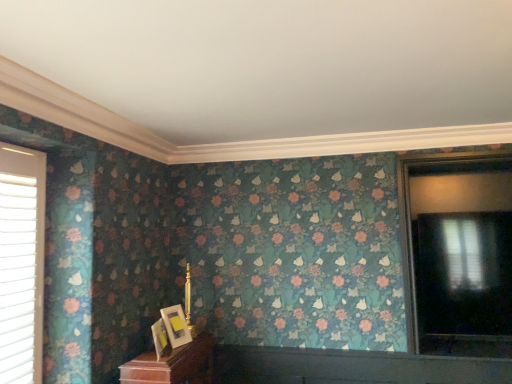
Question: Can you confirm if matte black window at right, which ranks as the first window in right-to-left order, is bigger than matte gold picture frame at lower center, which is the 1th picture frame in front-to-back order?

Choices:
 (A) no
 (B) yes

Answer: (B)

Question: Considering the relative sizes of matte black window at right, which is the second window from front to back, and matte gold picture frame at lower center, the 2th picture frame viewed from the back, in the image provided, is matte black window at right, which is the second window from front to back, shorter than matte gold picture frame at lower center, the 2th picture frame viewed from the back,?

Choices:
 (A) no
 (B) yes

Answer: (A)

Question: Does matte black window at right, which is the second window from front to back, have a greater height compared to matte gold picture frame at lower center, the 2th picture frame viewed from the back?

Choices:
 (A) yes
 (B) no

Answer: (A)

Question: Is matte gold picture frame at lower center, which is the 1th picture frame in front-to-back order, a part of matte black window at right, which ranks as the first window in right-to-left order?

Choices:
 (A) yes
 (B) no

Answer: (B)

Question: Does matte black window at right, which is the second window from front to back, lie in front of matte gold picture frame at lower center, the 2th picture frame viewed from the back?

Choices:
 (A) no
 (B) yes

Answer: (A)

Question: Looking at the image, does white plastic blinds at left, which is the 2th window in back-to-front order, seem bigger or smaller compared to matte gold picture frame at lower center, which is the 1th picture frame from back to front?

Choices:
 (A) big
 (B) small

Answer: (A)

Question: Is white plastic blinds at left, which is the 1th window in front-to-back order, inside the boundaries of matte gold picture frame at lower center, the 2th picture frame in the front-to-back sequence, or outside?

Choices:
 (A) outside
 (B) inside

Answer: (A)

Question: Is point (0, 200) positioned closer to the camera than point (164, 314)?

Choices:
 (A) farther
 (B) closer

Answer: (B)

Question: In terms of height, does white plastic blinds at left, which is the 1th window in front-to-back order, look taller or shorter compared to matte gold picture frame at lower center, which is the 1th picture frame from back to front?

Choices:
 (A) tall
 (B) short

Answer: (A)

Question: From a real-world perspective, is matte black window at right, which ranks as the first window in right-to-left order, positioned above or below matte gold picture frame at lower center, the 2th picture frame in the front-to-back sequence?

Choices:
 (A) above
 (B) below

Answer: (A)

Question: Is matte black window at right, which is the second window from front to back, spatially inside matte gold picture frame at lower center, the 2th picture frame in the front-to-back sequence, or outside of it?

Choices:
 (A) outside
 (B) inside

Answer: (A)

Question: Looking at the image, does matte black window at right, the second window viewed from the left, seem bigger or smaller compared to matte gold picture frame at lower center, which is the 1th picture frame from back to front?

Choices:
 (A) big
 (B) small

Answer: (A)

Question: Considering their positions, is matte black window at right, which ranks as the 1th window in back-to-front order, located in front of or behind matte gold picture frame at lower center, which is the 1th picture frame from back to front?

Choices:
 (A) front
 (B) behind

Answer: (B)

Question: Is matte gold picture frame at lower center, which is the 1th picture frame from back to front, in front of or behind matte black window at right, the second window viewed from the left, in the image?

Choices:
 (A) front
 (B) behind

Answer: (A)

Question: Is point (163, 317) positioned closer to the camera than point (488, 286)?

Choices:
 (A) closer
 (B) farther

Answer: (A)